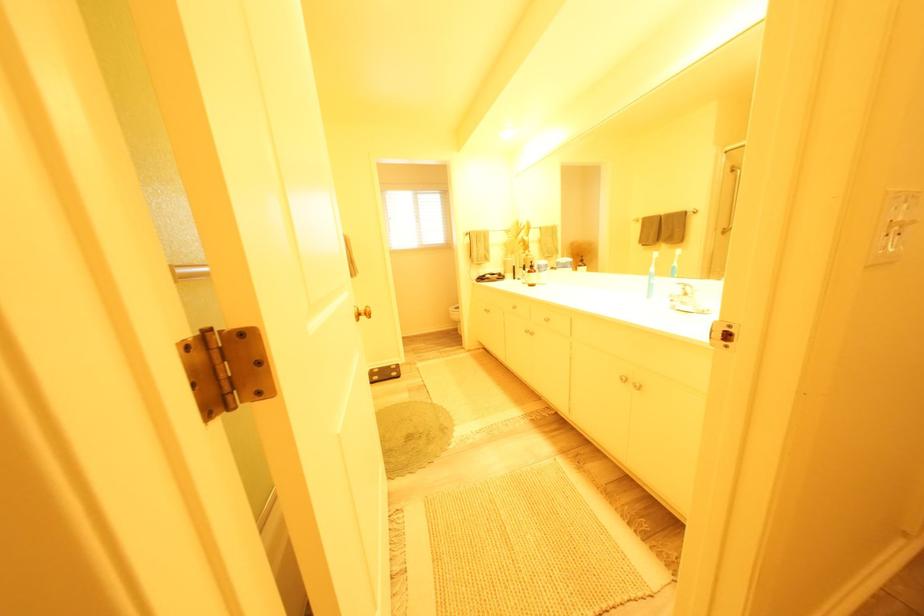
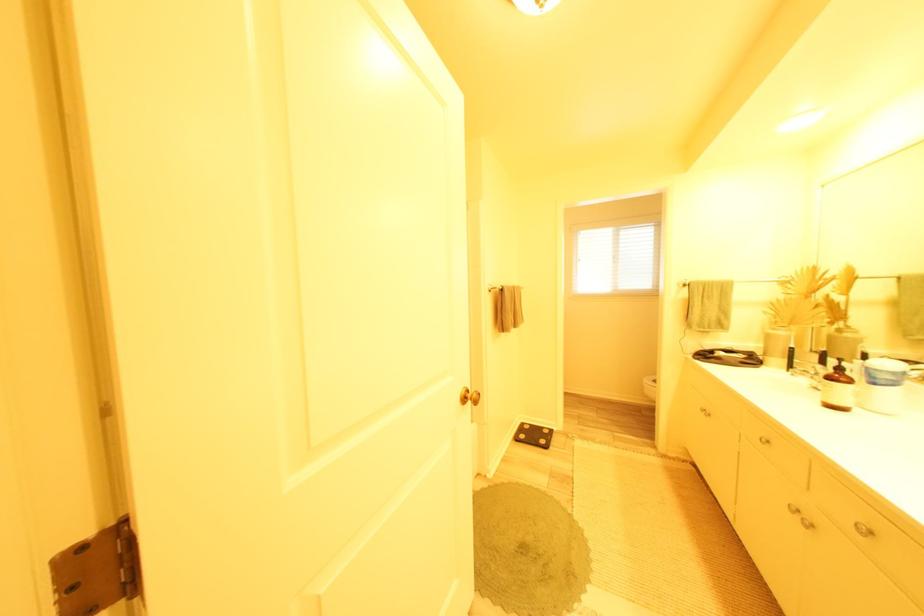
In the second image, find the point that corresponds to the point at 540,273 in the first image.

(841, 379)